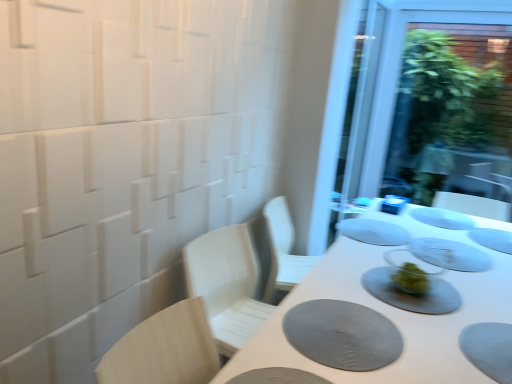
Image resolution: width=512 pixels, height=384 pixels. In order to click on free area in between clear glass plate at center, the fifth tableware positioned from the back, and gray textured placemat at lower right in this screenshot , I will do `click(395, 297)`.